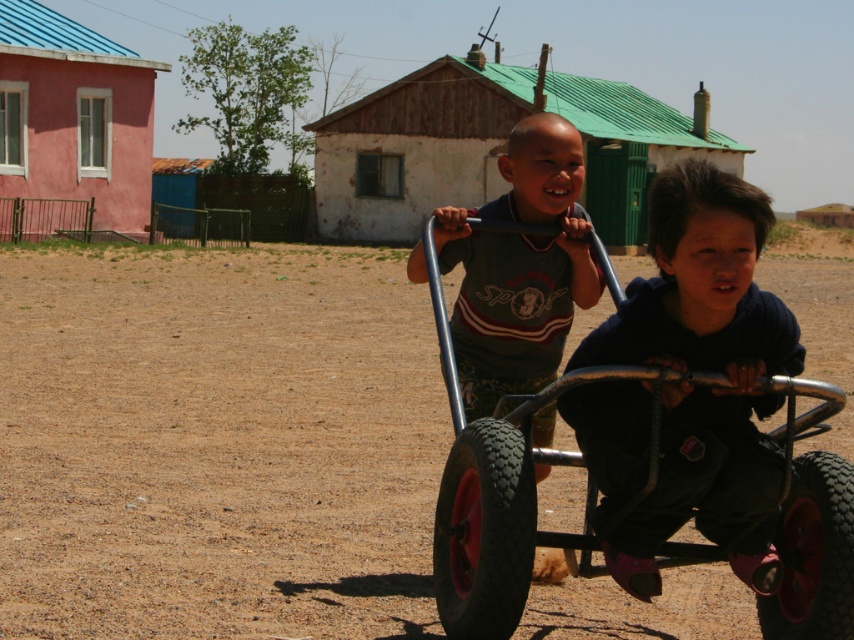
You are standing at the center of the image and want to go to the pink stucco house at left. Which direction should you go?

The pink stucco house at left is located at point [74,115], so you should go to the left direction to reach it.

You are a photographer trying to capture a photo of the pink stucco house at left without including the dark blue fleece at center in the frame. Based on their positions, is this possible?

The dark blue fleece at center is in front of the pink stucco house at left, so it would block the view. To capture the pink stucco house at left without the dark blue fleece at center, you would need to reposition yourself so that the dark blue fleece at center is not between you and the house.

You are planning to build a new shed in your backyard and want to ensure it fits between the white painted wood hut at center and the pink stucco house at left. Given their widths, which one is wider so you know where to place the shed?

The white painted wood hut at center is wider than the pink stucco house at left, so place the shed closer to the pink stucco house at left to accommodate the space.